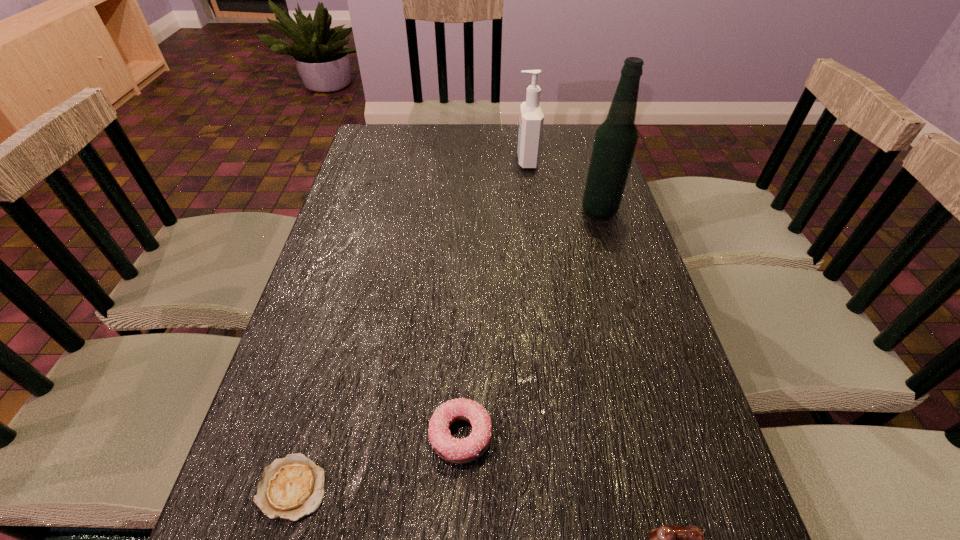
Image resolution: width=960 pixels, height=540 pixels. In the image, there is a desktop. Find the location of `vacant space at the far left corner`. vacant space at the far left corner is located at coordinates (391, 130).

You are a GUI agent. You are given a task and a screenshot of the screen. Output one action in this format:
    pyautogui.click(x=<x>, y=<y>)
    Task: Click on the vacant space at the far right corner of the desktop
    The image size is (960, 540).
    Given the screenshot: What is the action you would take?
    click(555, 132)

You are a GUI agent. You are given a task and a screenshot of the screen. Output one action in this format:
    pyautogui.click(x=<x>, y=<y>)
    Task: Click on the vacant region between the fourth shortest object and the shortest object
    The image size is (960, 540).
    Given the screenshot: What is the action you would take?
    pyautogui.click(x=410, y=324)

The image size is (960, 540). I want to click on vacant region between the second tallest object and the doughnut, so click(x=493, y=298).

Find the location of a particular element. Image resolution: width=960 pixels, height=540 pixels. object that is the nearest to the doughnut is located at coordinates (292, 487).

Locate an element on the screen. The height and width of the screenshot is (540, 960). object that is the third closest one to the leftmost object is located at coordinates (616, 138).

Locate an element on the screen. free region that satisfies the following two spatial constraints: 1. on the front label of the third object from left to right; 2. on the left side of the tallest object is located at coordinates pos(534,210).

Where is `vacant space that satisfies the following two spatial constraints: 1. on the back side of the second farthest object; 2. on the left side of the leftmost object`? The image size is (960, 540). vacant space that satisfies the following two spatial constraints: 1. on the back side of the second farthest object; 2. on the left side of the leftmost object is located at coordinates (371, 210).

Locate an element on the screen. Image resolution: width=960 pixels, height=540 pixels. vacant region that satisfies the following two spatial constraints: 1. on the front label of the fourth nearest object; 2. on the right side of the cleansing agent is located at coordinates (534, 210).

Where is `vacant space that satisfies the following two spatial constraints: 1. on the back side of the alcohol; 2. on the right side of the second object from left to right`? The width and height of the screenshot is (960, 540). vacant space that satisfies the following two spatial constraints: 1. on the back side of the alcohol; 2. on the right side of the second object from left to right is located at coordinates (468, 210).